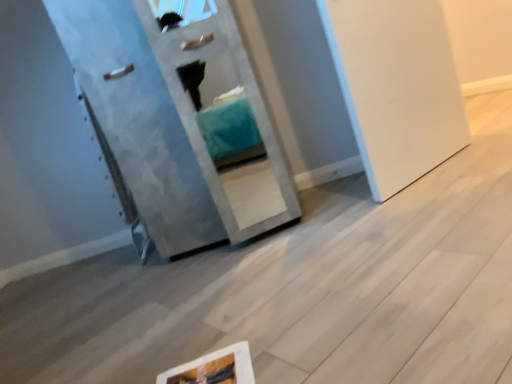
The width and height of the screenshot is (512, 384). What are the coordinates of `free space in front of matte gray cabinet at center` in the screenshot? It's located at (218, 298).